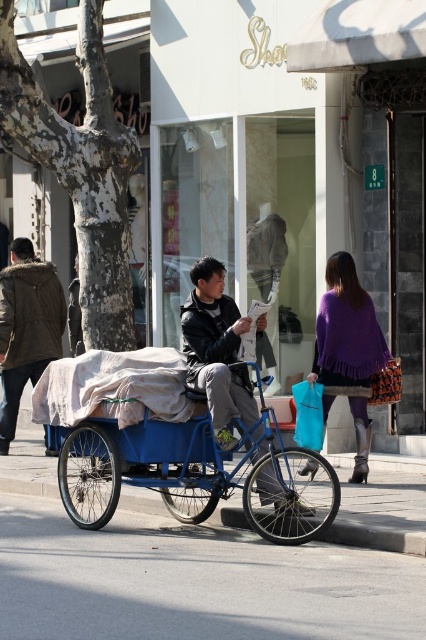
Question: Which of the following is the farthest from the observer?

Choices:
 (A) (98, 356)
 (B) (247, 381)
 (C) (270, 611)

Answer: (A)

Question: Does gray asphalt at lower center have a larger size compared to white cloth at center?

Choices:
 (A) no
 (B) yes

Answer: (B)

Question: Which point is farther from the camera taking this photo?

Choices:
 (A) (199, 460)
 (B) (219, 353)

Answer: (A)

Question: Which of the following is the closest to the observer?

Choices:
 (A) (0, 276)
 (B) (363, 461)
 (C) (259, 424)

Answer: (C)

Question: Considering the relative positions of blue matte tricycle at center and purple woolen shawl at center in the image provided, where is blue matte tricycle at center located with respect to purple woolen shawl at center?

Choices:
 (A) below
 (B) above

Answer: (A)

Question: Can you confirm if purple woolen shawl at center is thinner than brown fur-lined jacket at left?

Choices:
 (A) no
 (B) yes

Answer: (A)